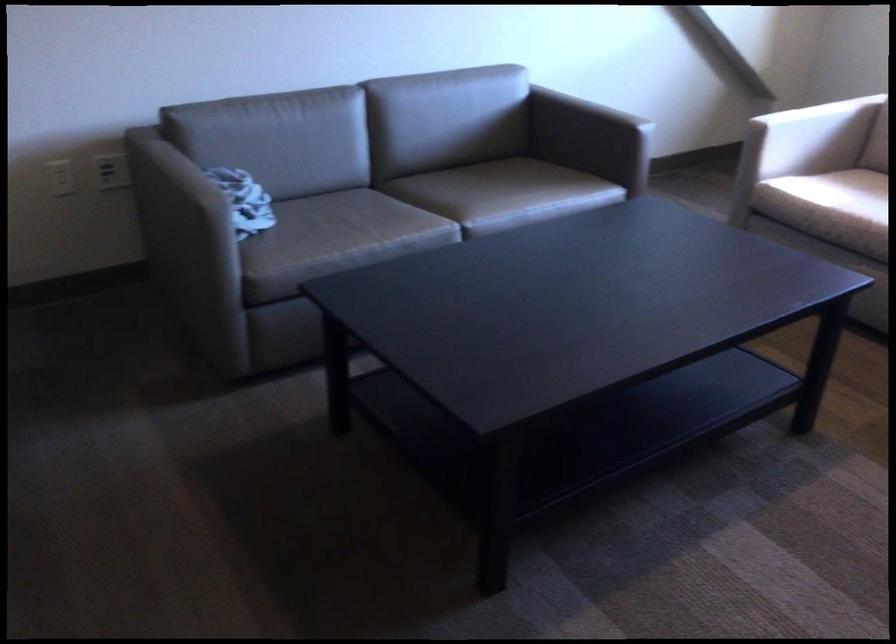
Find where to lean the white chair armrest. Please return your answer as a coordinate pair (x, y).

(824, 137)